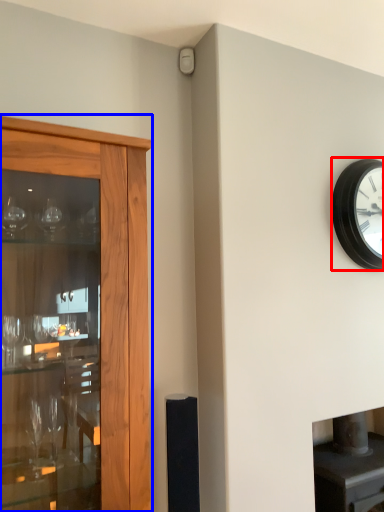
Question: Among these objects, which one is farthest to the camera, wall clock (highlighted by a red box) or cupboard (highlighted by a blue box)?

Choices:
 (A) wall clock
 (B) cupboard

Answer: (A)